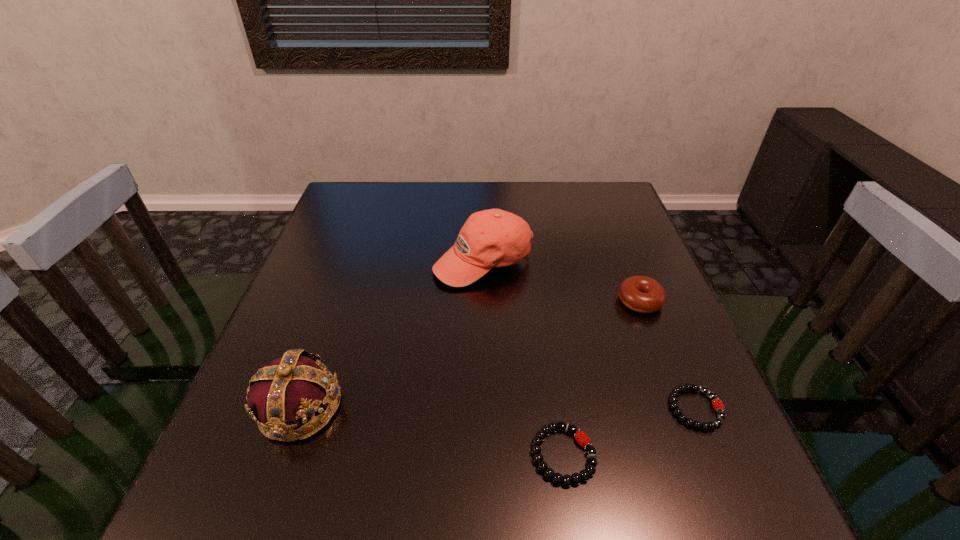
This screenshot has width=960, height=540. I want to click on baseball cap, so click(x=490, y=238).

Locate an element on the screen. crown is located at coordinates (290, 391).

Identify the location of the third shortest object. (642, 294).

You are a GUI agent. You are given a task and a screenshot of the screen. Output one action in this format:
    pyautogui.click(x=<x>, y=<y>)
    Task: Click on the left bracelet
    The width and height of the screenshot is (960, 540).
    Given the screenshot: What is the action you would take?
    pyautogui.click(x=584, y=475)

Where is `the right bracelet`? The width and height of the screenshot is (960, 540). the right bracelet is located at coordinates (717, 404).

Find the location of a particular element. vacant space situated 0.260m on the back of the baseball cap is located at coordinates (483, 188).

The image size is (960, 540). I want to click on free space located on the right of the crown, so click(x=519, y=407).

Identify the location of free space located 0.130m on the front of the doughnut. The height and width of the screenshot is (540, 960). (665, 365).

Identify the location of blank space located on the right of the left bracelet. (728, 455).

The image size is (960, 540). I want to click on vacant space located 0.230m on the left of the right bracelet, so click(542, 409).